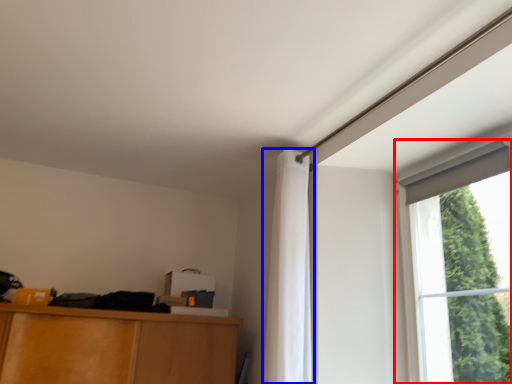
Question: Which of the following is the closest to the observer, window (highlighted by a red box) or curtain (highlighted by a blue box)?

Choices:
 (A) window
 (B) curtain

Answer: (A)